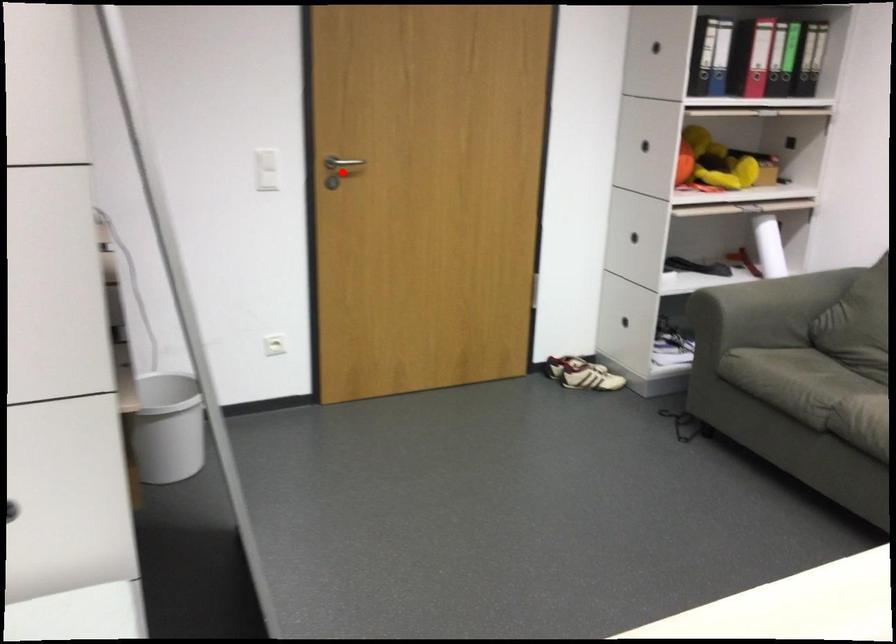
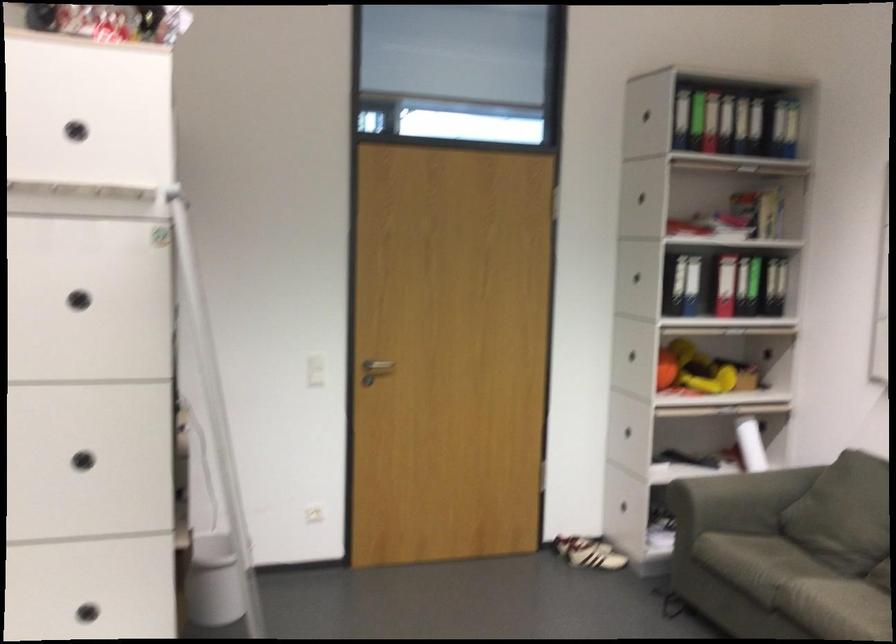
Find the pixel in the second image that matches the highlighted location in the first image.

(374, 370)